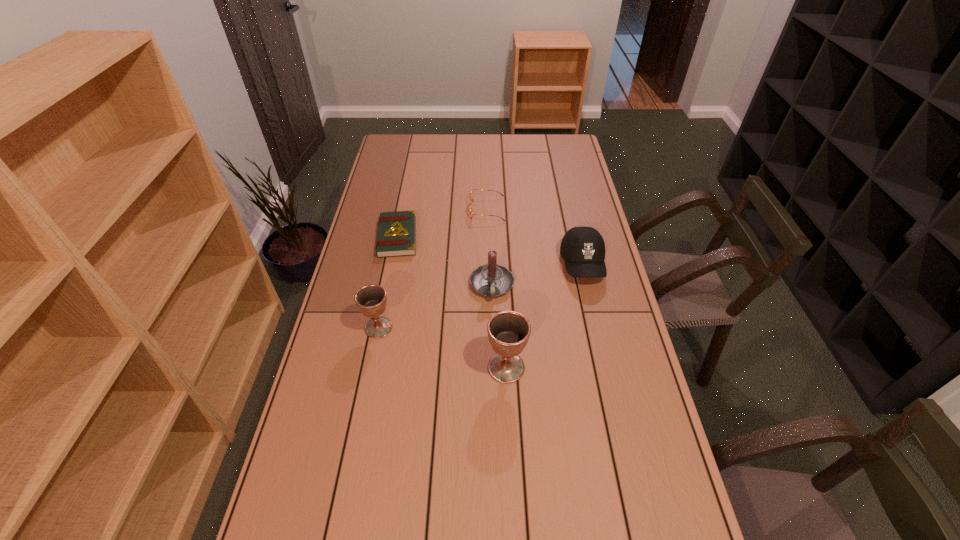
Image resolution: width=960 pixels, height=540 pixels. Find the location of `the farther chalice`. the farther chalice is located at coordinates click(x=371, y=300).

Where is `the left chalice`? The height and width of the screenshot is (540, 960). the left chalice is located at coordinates (371, 300).

Locate an element on the screen. This screenshot has height=540, width=960. the tallest object is located at coordinates (508, 331).

Find the location of `the taller chalice`. the taller chalice is located at coordinates 508,331.

The width and height of the screenshot is (960, 540). I want to click on the fifth tallest object, so click(x=471, y=193).

I want to click on the fourth tallest object, so click(x=583, y=249).

Find the location of a particular element. the rightmost object is located at coordinates (583, 249).

I want to click on the shortest object, so click(397, 230).

You are a GUI agent. You are given a task and a screenshot of the screen. Output one action in this format:
    pyautogui.click(x=<x>, y=<y>)
    Task: Click on the candle
    This screenshot has height=540, width=960.
    Given the screenshot: What is the action you would take?
    pos(491,280)

Locate an element on the screen. vacant region located on the right of the fifth farthest object is located at coordinates (442, 328).